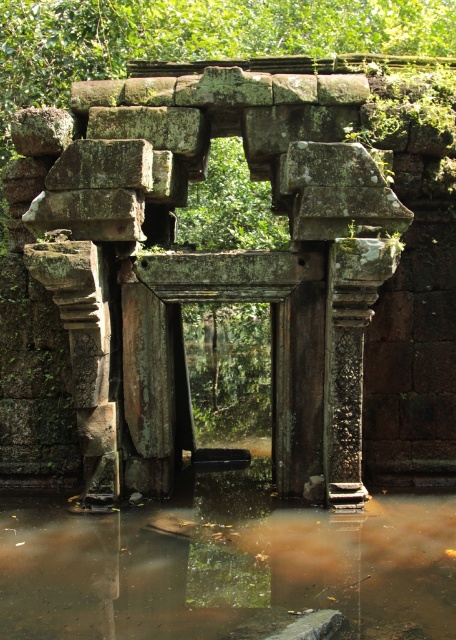
Does point (157, 253) lie behind point (420, 614)?

That is True.

What are the coordinates of `green mossy stone arch at center` in the screenshot? It's located at (224, 273).

Identify the location of green mossy stone arch at center. (224, 273).